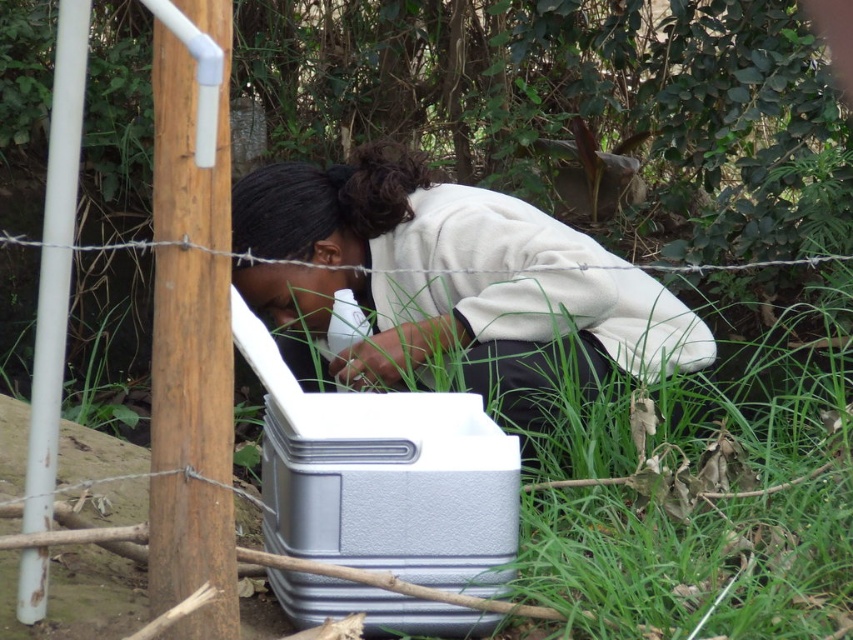
Does silver textured cooler at center have a larger size compared to brown wood pole at left?

Correct, silver textured cooler at center is larger in size than brown wood pole at left.

Is silver textured cooler at center further to the viewer compared to brown wood pole at left?

That is True.

Does point (236, 308) come farther from viewer compared to point (154, 289)?

That is True.

Where is `silver textured cooler at center`? silver textured cooler at center is located at coordinates (383, 476).

Which is behind, point (611, 326) or point (373, 472)?

The point (611, 326) is more distant.

Can you confirm if white matte cooler at center is taller than silver textured cooler at center?

Indeed, white matte cooler at center has a greater height compared to silver textured cooler at center.

Between point (355, 282) and point (459, 516), which one is positioned behind?

The point (355, 282) is more distant.

The height and width of the screenshot is (640, 853). Identify the location of white matte cooler at center. (448, 282).

In the scene shown: Does white matte cooler at center have a larger size compared to white matte pole at left?

Yes, white matte cooler at center is bigger than white matte pole at left.

Is white matte cooler at center to the left of white matte pole at left from the viewer's perspective?

Incorrect, white matte cooler at center is not on the left side of white matte pole at left.

What do you see at coordinates (448, 282) in the screenshot?
I see `white matte cooler at center` at bounding box center [448, 282].

Find the location of `white matte cooler at center`. white matte cooler at center is located at coordinates (448, 282).